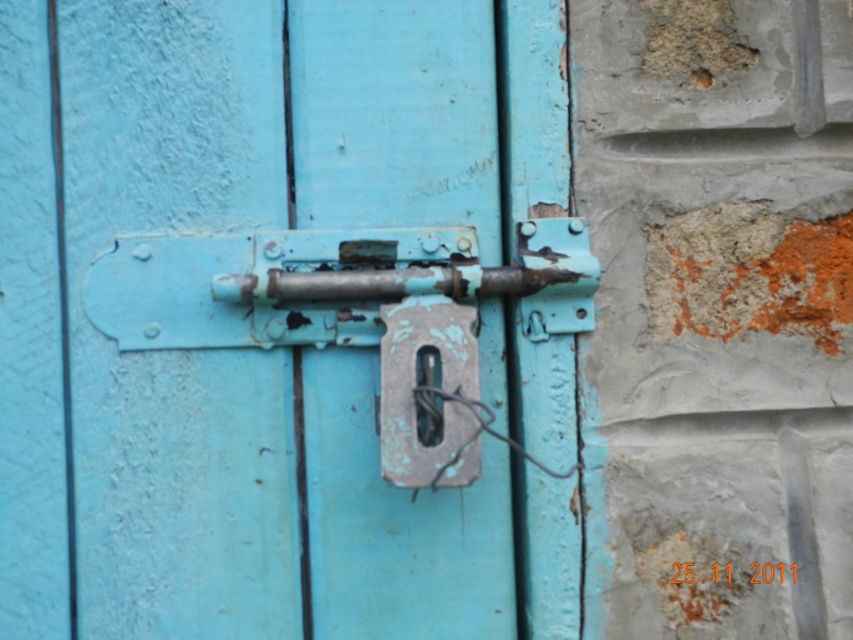
Is rusty metal lock at center further to camera compared to rusty metal padlock at center?

Yes, it is.

Is rusty metal lock at center below rusty metal padlock at center?

No, rusty metal lock at center is not below rusty metal padlock at center.

Who is more distant from viewer, (331,627) or (396,458)?

The point (331,627) is behind.

In order to click on rusty metal lock at center in this screenshot , I will do `click(285, 321)`.